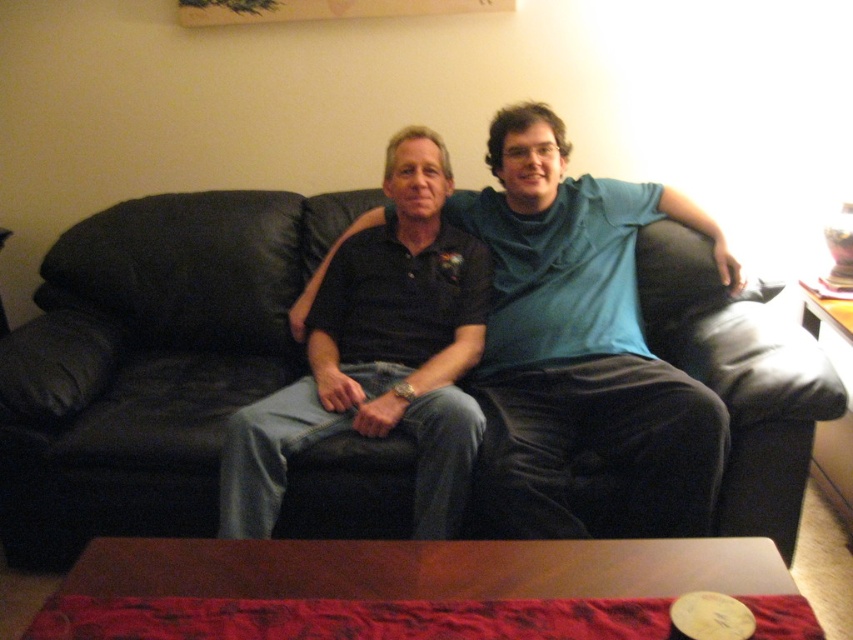
Question: Considering the real-world distances, which object is farthest from the matte black couch at center?

Choices:
 (A) black leather couch at center
 (B) matte black shirt at center

Answer: (A)

Question: Does black leather couch at center come behind matte black couch at center?

Choices:
 (A) yes
 (B) no

Answer: (A)

Question: Is black leather couch at center above matte black shirt at center?

Choices:
 (A) yes
 (B) no

Answer: (B)

Question: Estimate the real-world distances between objects in this image. Which object is farther from the matte black couch at center?

Choices:
 (A) black leather couch at center
 (B) matte black shirt at center

Answer: (A)

Question: Is black leather couch at center below matte black shirt at center?

Choices:
 (A) no
 (B) yes

Answer: (B)

Question: Considering the real-world distances, which object is closest to the matte black shirt at center?

Choices:
 (A) matte black couch at center
 (B) black leather couch at center

Answer: (A)